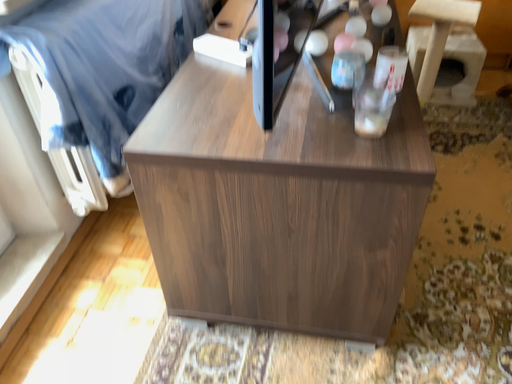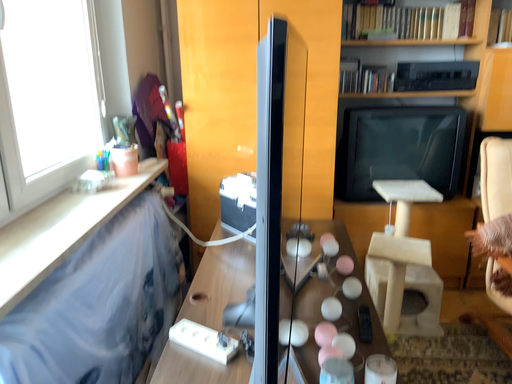
Question: How did the camera likely rotate when shooting the video?

Choices:
 (A) rotated upward
 (B) rotated downward

Answer: (A)